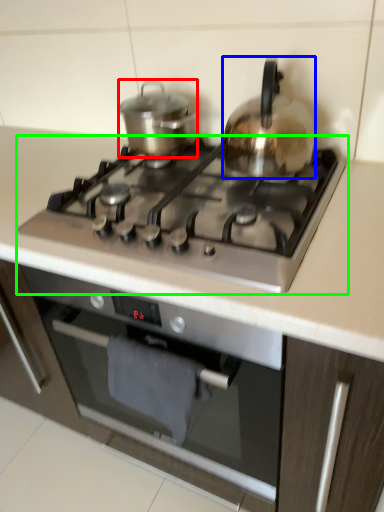
Question: Which object is the closest to the kitchen appliance (highlighted by a red box)? Choose among these: kitchen appliance (highlighted by a blue box) or gas stove (highlighted by a green box).

Choices:
 (A) kitchen appliance
 (B) gas stove

Answer: (A)